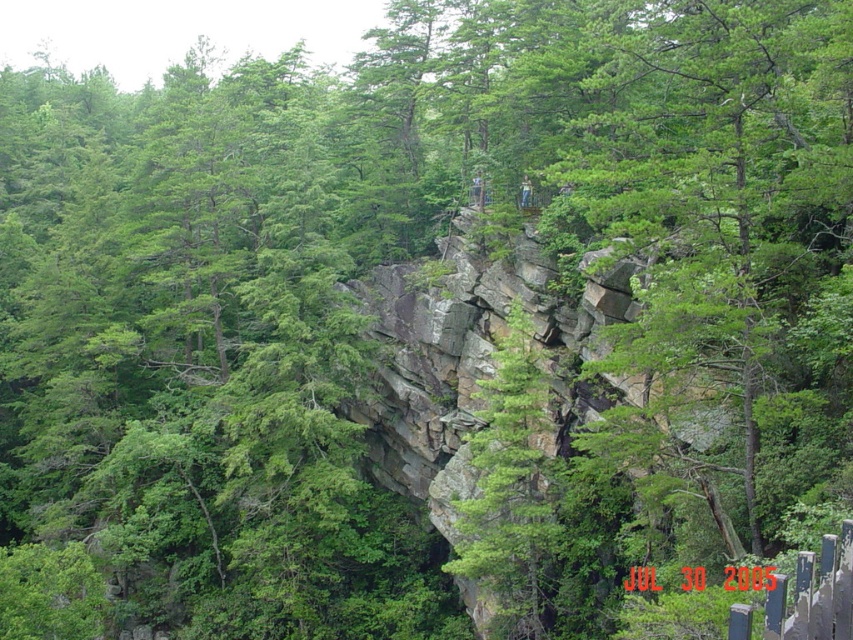
You are a hiker who wants to take a photo of both the green matte tree at center and the green rough bark tree at center from a distance. Which tree will appear bigger in the photo?

The green matte tree at center will appear bigger in the photo because it has a larger size compared to the green rough bark tree at center.

You are a park ranger assessing the trees in the forest. You need to determine which tree has a larger trunk diameter between the green matte tree at center and the green rough bark tree at center. Based on their appearance, which one is wider?

The green matte tree at center might be wider than green rough bark tree at center according to the description.

You are a hiker trying to identify two trees in the forest. You see a green matte tree at center and a green rough bark tree at center. Which tree is positioned to the right of the other?

The green matte tree at center is to the right of the green rough bark tree at center.